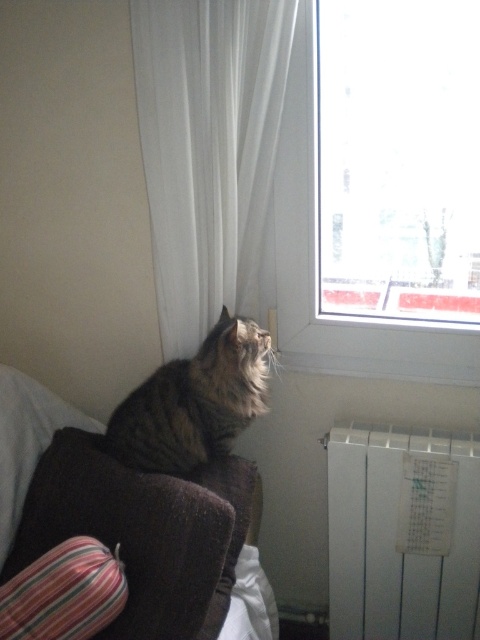
You are an interior designer planning to replace the white sheer curtain at upper center and the white matte radiator at lower right with new ones. If you want to keep the same size for both items, which one might require resizing first?

The white sheer curtain at upper center is bigger than the white matte radiator at lower right, so the radiator would need to be resized to match the curtain size.

Based on the scene description, where is the white sheer curtain at upper center located in the image?

The white sheer curtain at upper center is located at point (208,148).

You are a person who wants to place a tall plant pot between the white matte radiator at lower right and the velvet brown couch at lower left. Based on their heights, which object should the plant pot be placed closer to?

The white matte radiator at lower right is taller than the velvet brown couch at lower left. To ensure the plant pot is proportionate in height, it should be placed closer to the shorter velvet brown couch at lower left.